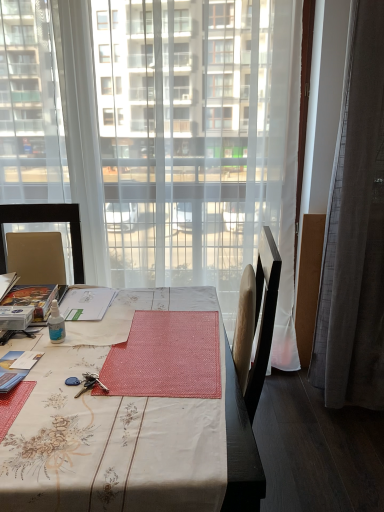
Find the location of a particular element. free space to the left of transparent plastic bottle at table center is located at coordinates (29, 337).